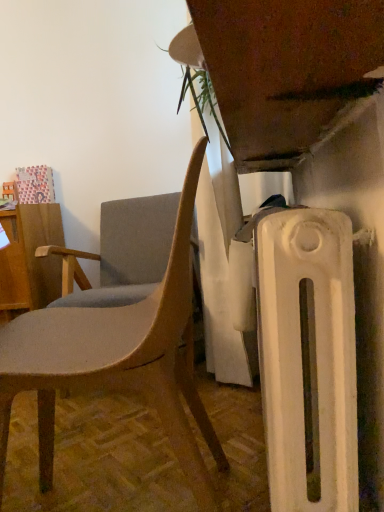
Question: Is point (107, 384) closer or farther from the camera than point (119, 218)?

Choices:
 (A) farther
 (B) closer

Answer: (B)

Question: Considering the relative positions of matte gray chair at center, the first chair from the front, and matte gray fabric chair at left, arranged as the first chair when viewed from the back, in the image provided, is matte gray chair at center, the first chair from the front, to the left or to the right of matte gray fabric chair at left, arranged as the first chair when viewed from the back,?

Choices:
 (A) right
 (B) left

Answer: (A)

Question: Estimate the real-world distances between objects in this image. Which object is farther from the wooden desk at left?

Choices:
 (A) matte gray fabric chair at left, arranged as the first chair when viewed from the back
 (B) matte gray chair at center, which is the 2th chair in back-to-front order

Answer: (B)

Question: Which is farther from the matte gray fabric chair at left, arranged as the first chair when viewed from the back?

Choices:
 (A) matte gray chair at center, which is the 2th chair in back-to-front order
 (B) wooden desk at left

Answer: (A)